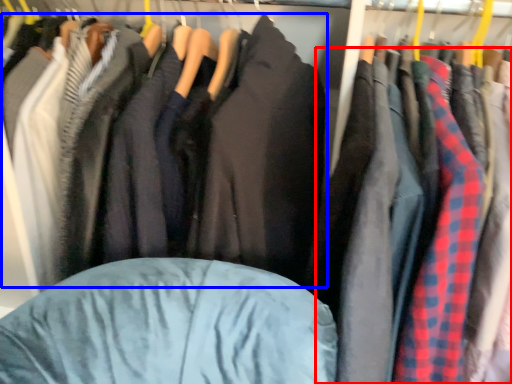
Question: Which object is closer to the camera taking this photo, clothing (highlighted by a red box) or jacket (highlighted by a blue box)?

Choices:
 (A) clothing
 (B) jacket

Answer: (A)